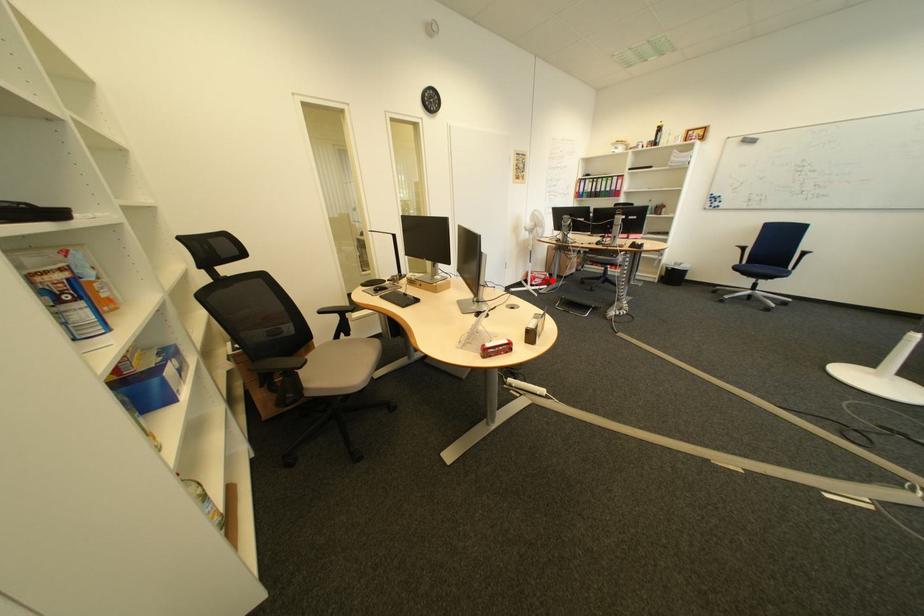
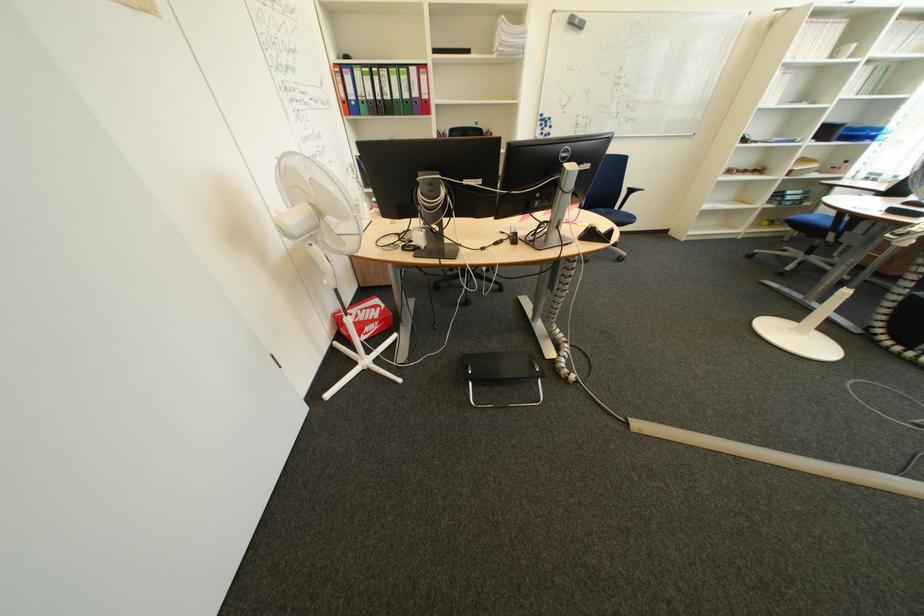
Question: I am providing you with two images of the same scene from different viewpoints. In image1, a red point is highlighted. Considering the same 3D point in image2, which of the following is correct?

Choices:
 (A) It is closer
 (B) It is farther

Answer: (B)